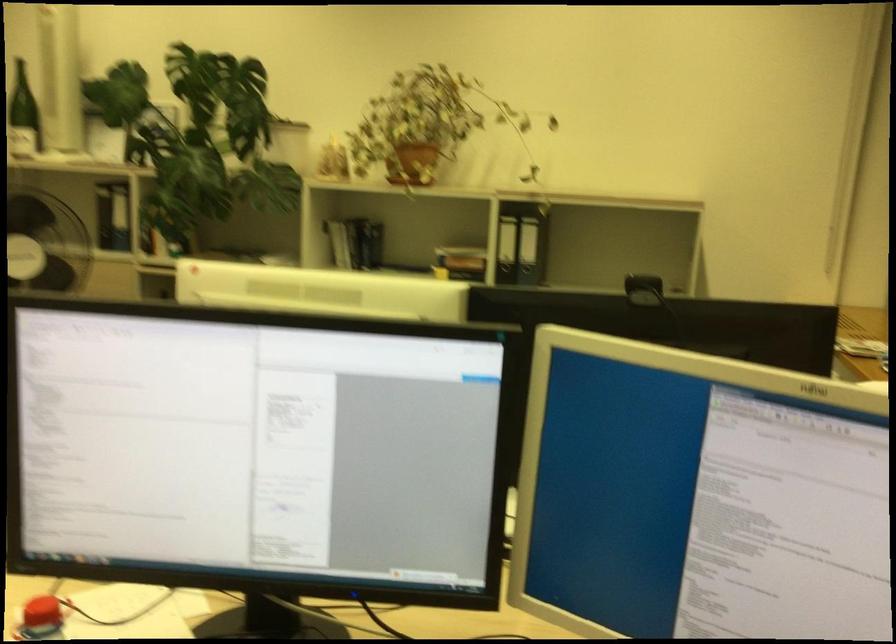
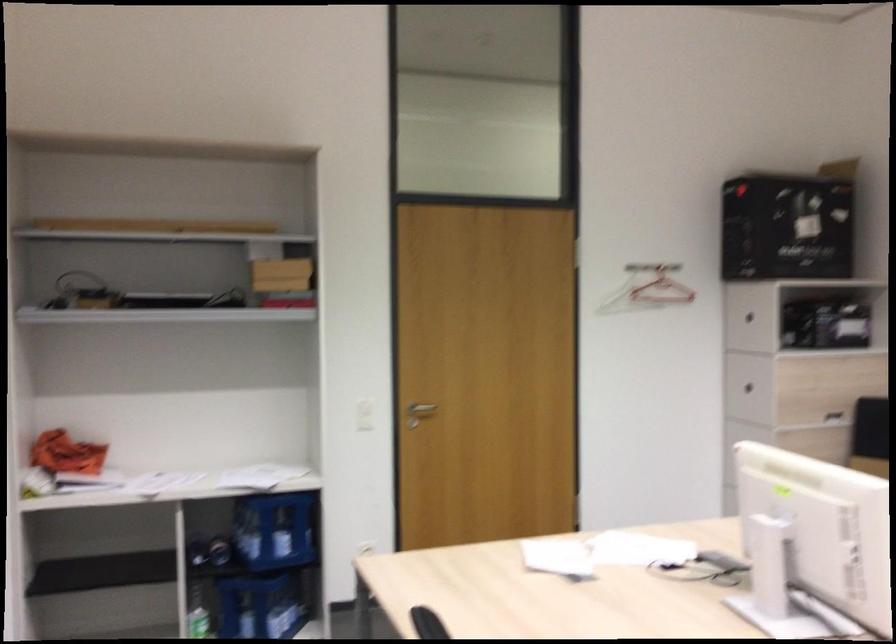
Question: The camera is either moving clockwise (left) or counter-clockwise (right) around the object. The first image is from the beginning of the video and the second image is from the end. Is the camera moving left or right when shooting the video?

Choices:
 (A) Left
 (B) Right

Answer: (B)